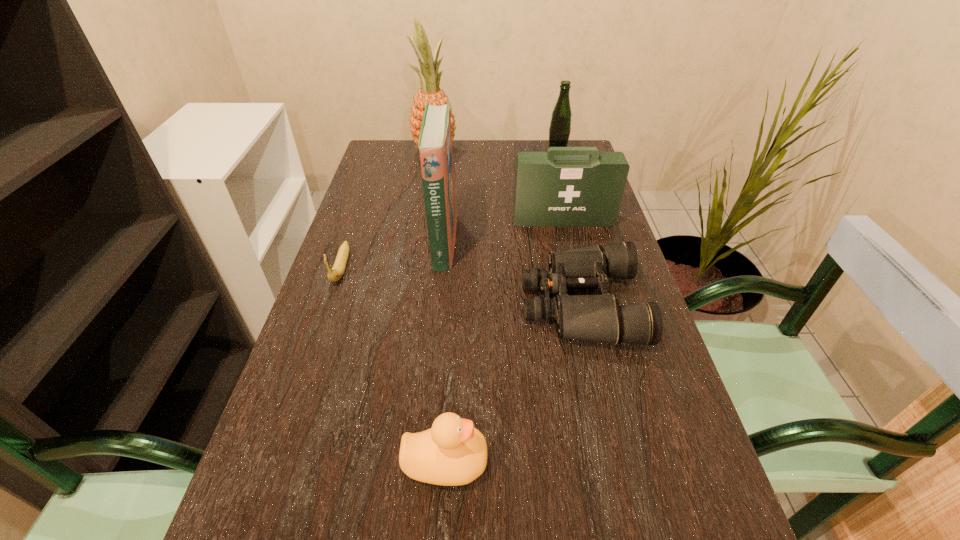
Find the location of a particular element. The height and width of the screenshot is (540, 960). banana present at the left edge is located at coordinates (337, 271).

I want to click on beer bottle that is positioned at the right edge, so click(x=560, y=126).

Find the location of a particular element. The width and height of the screenshot is (960, 540). the first-aid kit present at the right edge is located at coordinates (566, 186).

Find the location of a particular element. Image resolution: width=960 pixels, height=540 pixels. binoculars that is at the right edge is located at coordinates (599, 318).

This screenshot has height=540, width=960. I want to click on object that is at the far left corner, so click(430, 91).

What are the coordinates of `object at the far right corner` in the screenshot? It's located at (560, 126).

What are the coordinates of `free space at the far edge` in the screenshot? It's located at (538, 151).

This screenshot has width=960, height=540. In the image, there is a desktop. In order to click on vacant space at the left edge in this screenshot , I will do `click(378, 186)`.

What are the coordinates of `free point at the right edge` in the screenshot? It's located at (617, 358).

The width and height of the screenshot is (960, 540). In order to click on vacant space at the far right corner of the desktop in this screenshot , I will do coord(586,145).